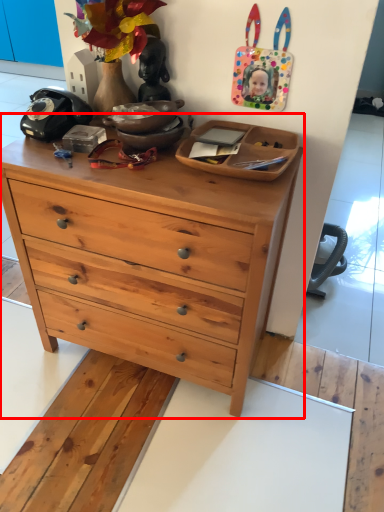
Question: From the image, what is the correct spatial relationship of chest of drawers (annotated by the red box) in relation to cabinetry?

Choices:
 (A) right
 (B) left

Answer: (B)